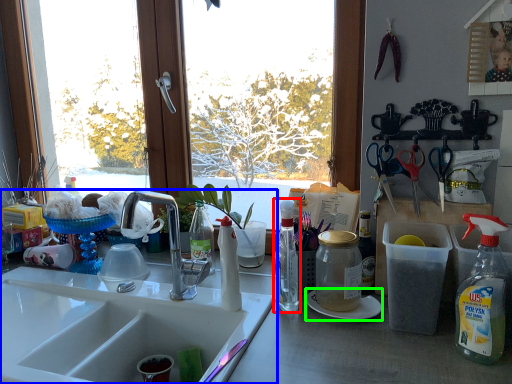
Question: Based on their relative distances, which object is farther from bottle (highlighted by a red box)? Choose from sink (highlighted by a blue box) and paper plate (highlighted by a green box).

Choices:
 (A) sink
 (B) paper plate

Answer: (A)